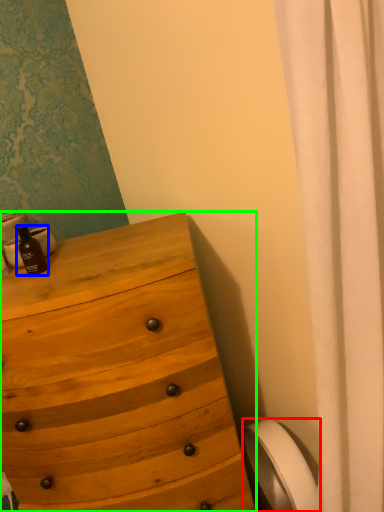
Question: Considering the real-world distances, which object is closest to toilet paper (highlighted by a red box)? bottle (highlighted by a blue box) or chest of drawers (highlighted by a green box).

Choices:
 (A) bottle
 (B) chest of drawers

Answer: (B)